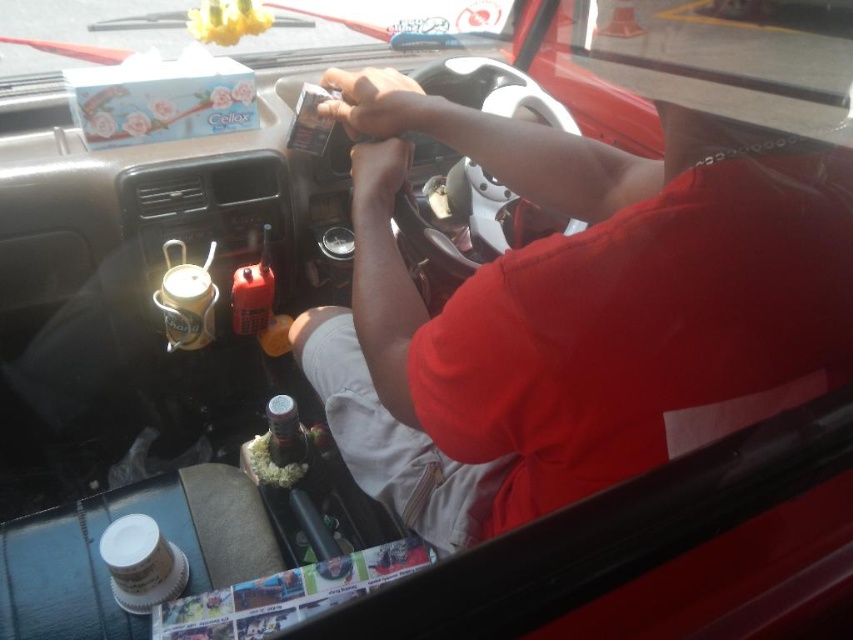
Is matte black phone at center further to camera compared to matte skin hand at center?

Yes.

Can you confirm if matte black phone at center is shorter than matte skin hand at center?

In fact, matte black phone at center may be taller than matte skin hand at center.

Which is behind, point (378, 88) or point (396, 138)?

Point (378, 88)

This screenshot has width=853, height=640. I want to click on matte black phone at center, so click(x=376, y=104).

From the picture: Which is more to the left, matte skin hand at center or white crumbly food at center?

Positioned to the left is white crumbly food at center.

Does matte skin hand at center have a greater height compared to white crumbly food at center?

Indeed, matte skin hand at center has a greater height compared to white crumbly food at center.

This screenshot has height=640, width=853. Find the location of `matte skin hand at center`. matte skin hand at center is located at coordinates (378, 173).

Identify the location of matte skin hand at center. (378, 173).

Can you confirm if matte black phone at center is taller than clear plastic bottle at center?

Indeed, matte black phone at center has a greater height compared to clear plastic bottle at center.

In order to click on matte black phone at center in this screenshot , I will do `click(376, 104)`.

The image size is (853, 640). What are the coordinates of `matte black phone at center` in the screenshot? It's located at (376, 104).